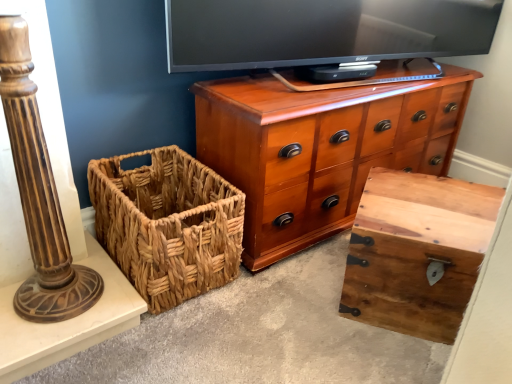
Question: From the image's perspective, is woven brown basket at lower left above or below shiny wood chest of drawers at center?

Choices:
 (A) above
 (B) below

Answer: (B)

Question: Looking at the image, does woven brown basket at lower left seem bigger or smaller compared to shiny wood chest of drawers at center?

Choices:
 (A) small
 (B) big

Answer: (A)

Question: Which of these objects is positioned closest to the shiny wood chest of drawers at center?

Choices:
 (A) woven brown basket at lower left
 (B) rustic wood trunk at center
 (C) brown polished wood column at left

Answer: (A)

Question: Estimate the real-world distances between objects in this image. Which object is closer to the shiny wood chest of drawers at center?

Choices:
 (A) woven brown basket at lower left
 (B) rustic wood trunk at center
 (C) brown polished wood column at left

Answer: (A)